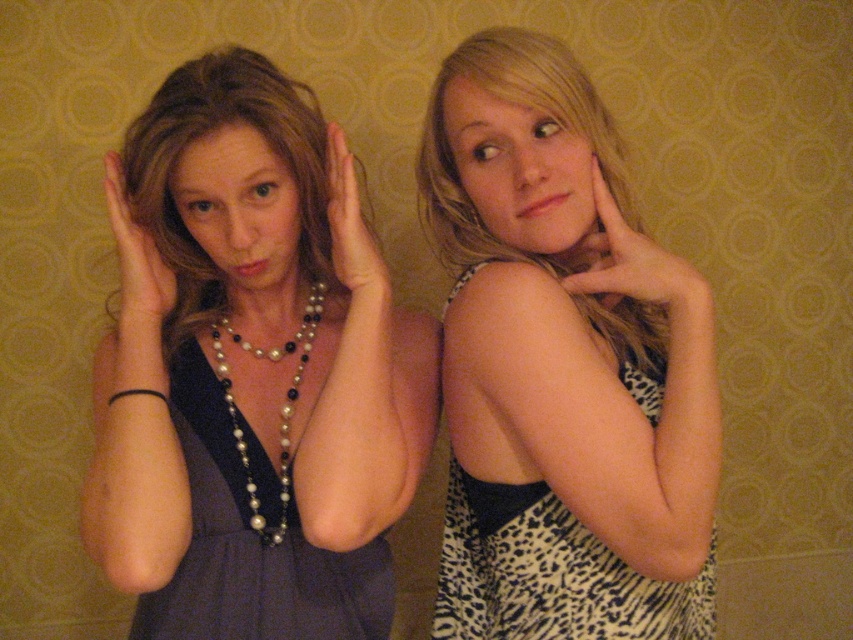
Question: From the image, what is the correct spatial relationship of smooth skin hand at right in relation to pearl necklace at upper center?

Choices:
 (A) left
 (B) right

Answer: (B)

Question: Is matte black dress at left below smooth skin hand at right?

Choices:
 (A) no
 (B) yes

Answer: (B)

Question: Estimate the real-world distances between objects in this image. Which object is farther from the pearl necklace at upper center?

Choices:
 (A) dark blue satin dress at left
 (B) smooth skin hand at right
 (C) matte black dress at left

Answer: (A)

Question: Considering the relative positions of leopard print dress at center and smooth skin hand at right in the image provided, where is leopard print dress at center located with respect to smooth skin hand at right?

Choices:
 (A) right
 (B) left

Answer: (B)

Question: Which point is farther to the camera?

Choices:
 (A) smooth skin hand at right
 (B) pearl necklace at upper center
 (C) matte black hand at left
 (D) dark blue satin dress at left

Answer: (D)

Question: Which of these objects is positioned farthest from the matte black dress at left?

Choices:
 (A) pearl necklace at center
 (B) dark blue satin dress at left
 (C) leopard print dress at center
 (D) pearl/leather necklace at center

Answer: (C)